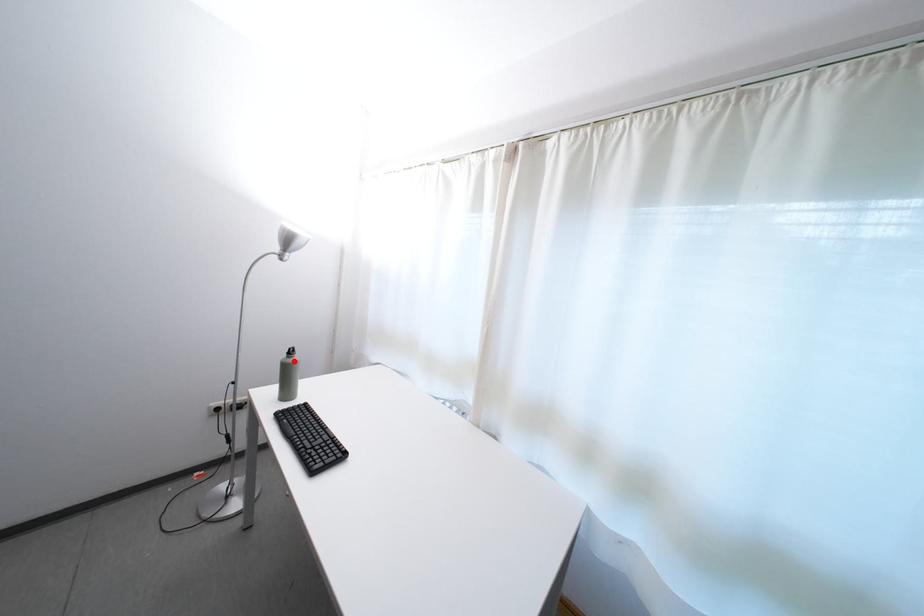
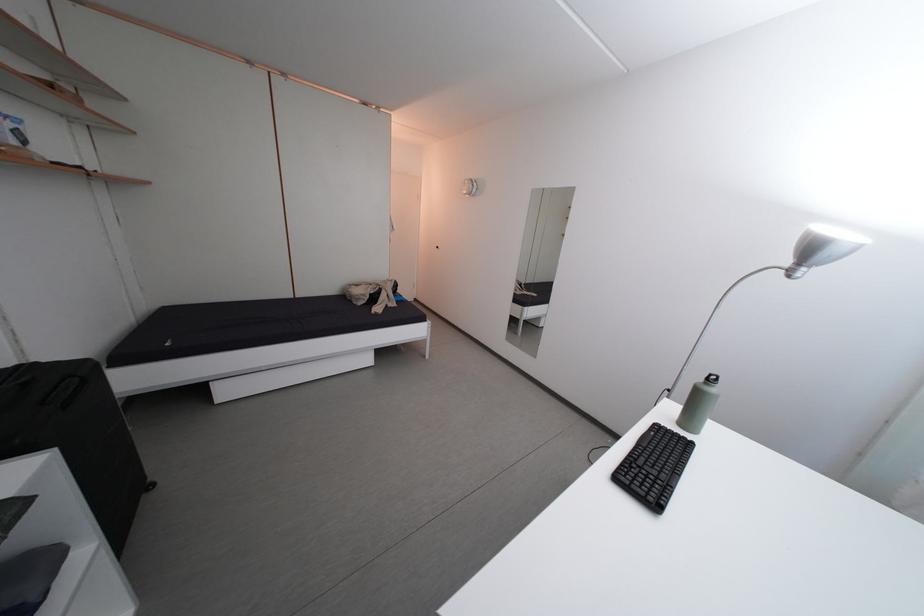
Find the pixel in the second image that matches the highlighted location in the first image.

(712, 386)